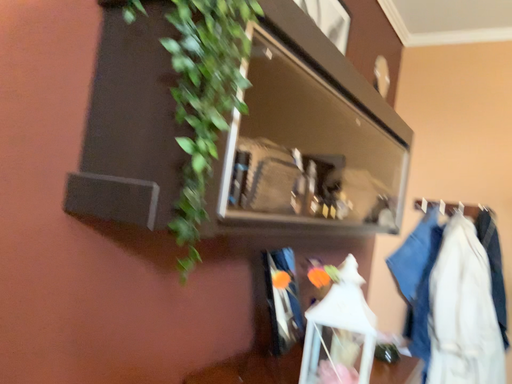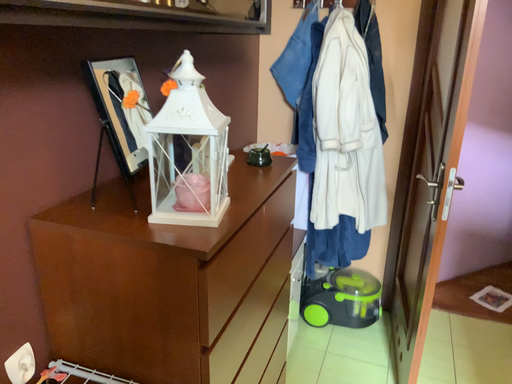
Question: Which way did the camera rotate in the video?

Choices:
 (A) rotated upward
 (B) rotated downward

Answer: (B)